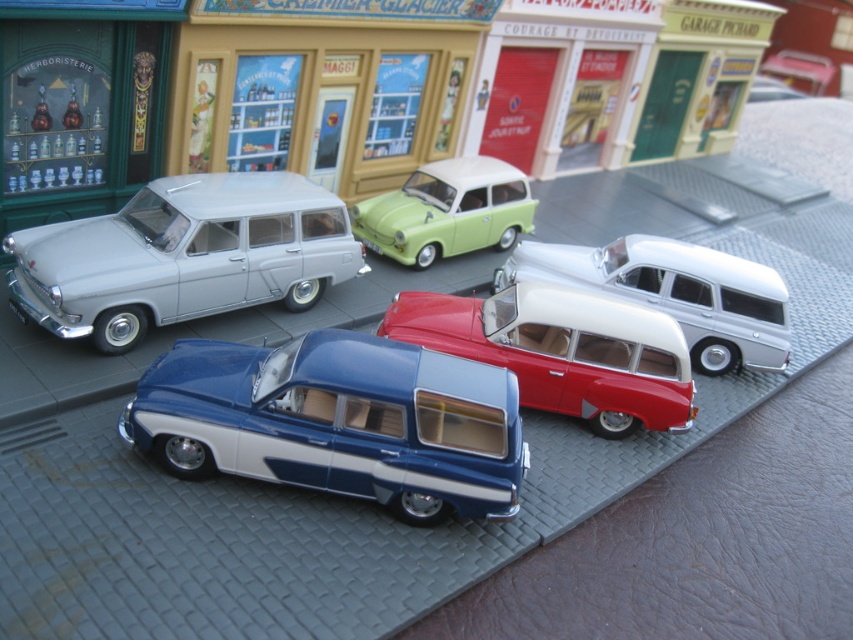
Does matte white station wagon at center have a greater width compared to white glossy station wagon at center?

In fact, matte white station wagon at center might be narrower than white glossy station wagon at center.

Who is higher up, matte white station wagon at center or white glossy station wagon at center?

white glossy station wagon at center is above.

What do you see at coordinates (561, 352) in the screenshot? This screenshot has width=853, height=640. I see `matte white station wagon at center` at bounding box center [561, 352].

The height and width of the screenshot is (640, 853). I want to click on matte white station wagon at center, so click(561, 352).

Based on the photo, does blue metallic station wagon at center have a greater width compared to matte silver station wagon at left?

No.

Is point (259, 397) behind point (100, 272)?

No, it is not.

Between point (465, 404) and point (235, 291), which one is positioned in front?

Positioned in front is point (465, 404).

Find the location of a particular element. This screenshot has width=853, height=640. blue metallic station wagon at center is located at coordinates (338, 420).

Between matte silver station wagon at left and white glossy station wagon at center, which one is positioned lower?

white glossy station wagon at center is below.

Is matte silver station wagon at left bigger than white glossy station wagon at center?

Yes.

Where is `matte silver station wagon at left`? Image resolution: width=853 pixels, height=640 pixels. matte silver station wagon at left is located at coordinates (183, 257).